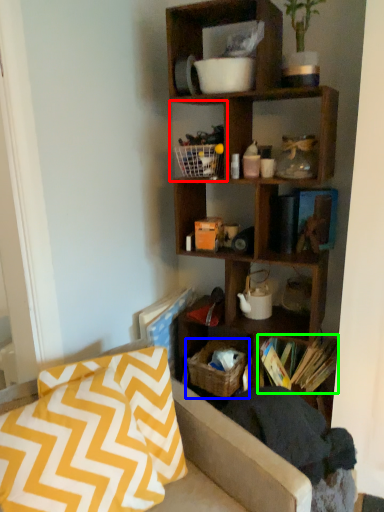
Question: Considering the real-world distances, which object is closest to cabinet (highlighted by a red box)? crate (highlighted by a blue box) or book (highlighted by a green box).

Choices:
 (A) crate
 (B) book

Answer: (A)